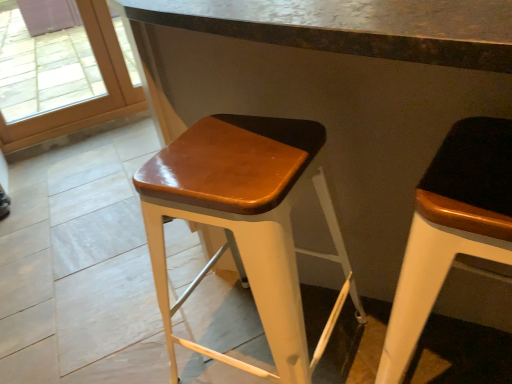
Question: Can you confirm if transparent glass door at upper left is taller than glossy wood stool at center, acting as the second stool starting from the right?

Choices:
 (A) no
 (B) yes

Answer: (B)

Question: Is transparent glass door at upper left facing away from glossy wood stool at center, acting as the second stool starting from the right?

Choices:
 (A) yes
 (B) no

Answer: (B)

Question: From a real-world perspective, is transparent glass door at upper left positioned under glossy wood stool at center, acting as the second stool starting from the right, based on gravity?

Choices:
 (A) no
 (B) yes

Answer: (A)

Question: Is transparent glass door at upper left closer to camera compared to glossy wood stool at center, acting as the second stool starting from the right?

Choices:
 (A) no
 (B) yes

Answer: (A)

Question: Is transparent glass door at upper left positioned far away from glossy wood stool at center, which ranks as the 1th stool in left-to-right order?

Choices:
 (A) no
 (B) yes

Answer: (B)

Question: Can you confirm if transparent glass door at upper left is shorter than glossy wood stool at center, which ranks as the 1th stool in left-to-right order?

Choices:
 (A) yes
 (B) no

Answer: (B)

Question: Is glossy wood stool at center, which ranks as the 1th stool in left-to-right order, taller than matte black stool at right, the 1th stool positioned from the right?

Choices:
 (A) yes
 (B) no

Answer: (B)

Question: From a real-world perspective, is glossy wood stool at center, which ranks as the 1th stool in left-to-right order, under matte black stool at right, the 1th stool positioned from the right?

Choices:
 (A) yes
 (B) no

Answer: (A)

Question: Is glossy wood stool at center, which ranks as the 1th stool in left-to-right order, bigger than matte black stool at right, which is the second stool from left to right?

Choices:
 (A) yes
 (B) no

Answer: (A)

Question: Would you consider glossy wood stool at center, acting as the second stool starting from the right, to be distant from matte black stool at right, the 1th stool positioned from the right?

Choices:
 (A) no
 (B) yes

Answer: (A)

Question: Is glossy wood stool at center, acting as the second stool starting from the right, thinner than matte black stool at right, the 1th stool positioned from the right?

Choices:
 (A) yes
 (B) no

Answer: (B)

Question: From a real-world perspective, is glossy wood stool at center, acting as the second stool starting from the right, on matte black stool at right, which is the second stool from left to right?

Choices:
 (A) yes
 (B) no

Answer: (B)

Question: From the image's perspective, does transparent glass door at upper left appear lower than matte black stool at right, which is the second stool from left to right?

Choices:
 (A) no
 (B) yes

Answer: (A)